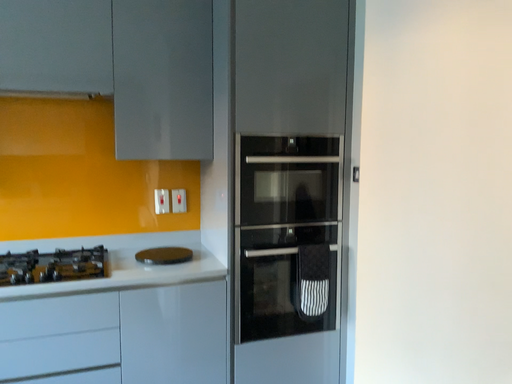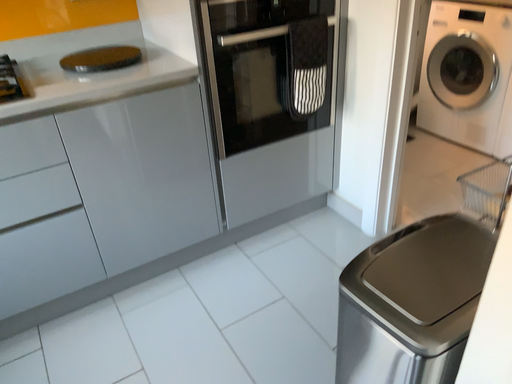
Question: How did the camera likely rotate when shooting the video?

Choices:
 (A) rotated upward
 (B) rotated downward

Answer: (B)